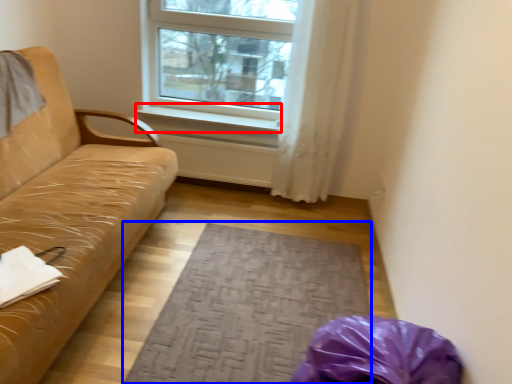
Question: Which object appears farthest to the camera in this image, window sill (highlighted by a red box) or mat (highlighted by a blue box)?

Choices:
 (A) window sill
 (B) mat

Answer: (A)